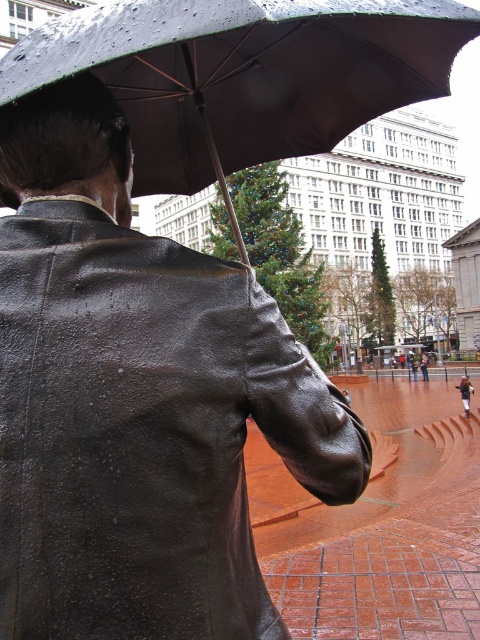
How far apart are shiny black umbrella at upper center and brown leather jacket at center?

They are 109.78 feet apart.

Is shiny black umbrella at upper center closer to camera compared to brown leather jacket at center?

Yes, it is in front of brown leather jacket at center.

Locate an element on the screen. Image resolution: width=480 pixels, height=640 pixels. shiny black umbrella at upper center is located at coordinates (243, 74).

Who is higher up, shiny brown coat at center or brown leather jacket at center?

shiny brown coat at center is above.

Does point (313, 417) come farther from viewer compared to point (468, 394)?

No, it is not.

The width and height of the screenshot is (480, 640). What are the coordinates of `shiny brown coat at center` in the screenshot? It's located at (136, 401).

How distant is shiny brown coat at center from shiny black umbrella at upper center?

11.14 feet

Is shiny brown coat at center smaller than shiny black umbrella at upper center?

Correct, shiny brown coat at center occupies less space than shiny black umbrella at upper center.

The image size is (480, 640). What are the coordinates of `shiny brown coat at center` in the screenshot? It's located at (136, 401).

The height and width of the screenshot is (640, 480). Find the location of `shiny brown coat at center`. shiny brown coat at center is located at coordinates (136, 401).